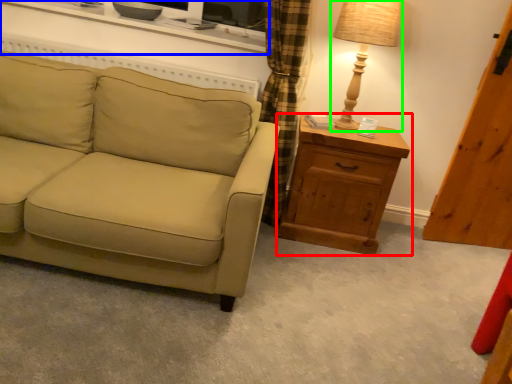
Question: Which object is the closest to the chest of drawers (highlighted by a red box)? Choose among these: entertainment center (highlighted by a blue box) or table lamp (highlighted by a green box).

Choices:
 (A) entertainment center
 (B) table lamp

Answer: (B)